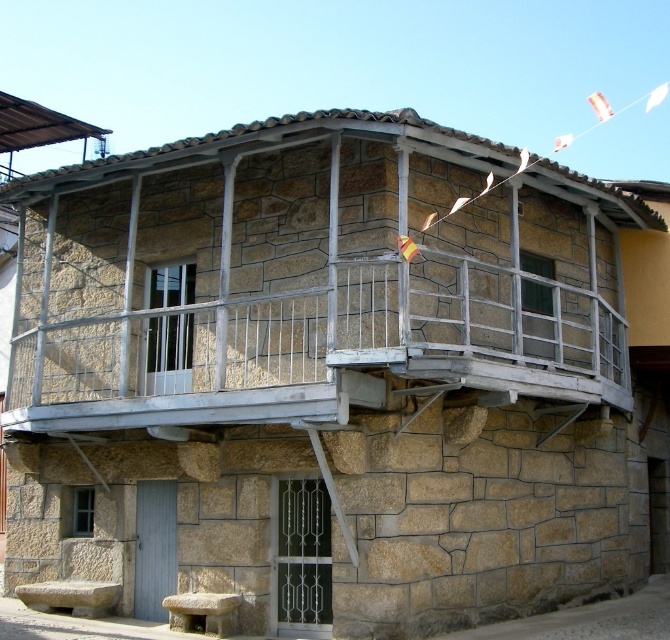
Question: Which point is farther to the camera?

Choices:
 (A) (285, 284)
 (B) (186, 625)

Answer: (A)

Question: Does white wooden balcony at upper center come behind smooth stone bench at lower center?

Choices:
 (A) no
 (B) yes

Answer: (B)

Question: Is white wooden balcony at upper center wider than smooth stone bench at lower center?

Choices:
 (A) yes
 (B) no

Answer: (B)

Question: In this image, where is white wooden balcony at upper center located relative to smooth stone bench at lower center?

Choices:
 (A) above
 (B) below

Answer: (A)

Question: Which of the following is the farthest from the observer?

Choices:
 (A) (582, 276)
 (B) (184, 611)

Answer: (A)